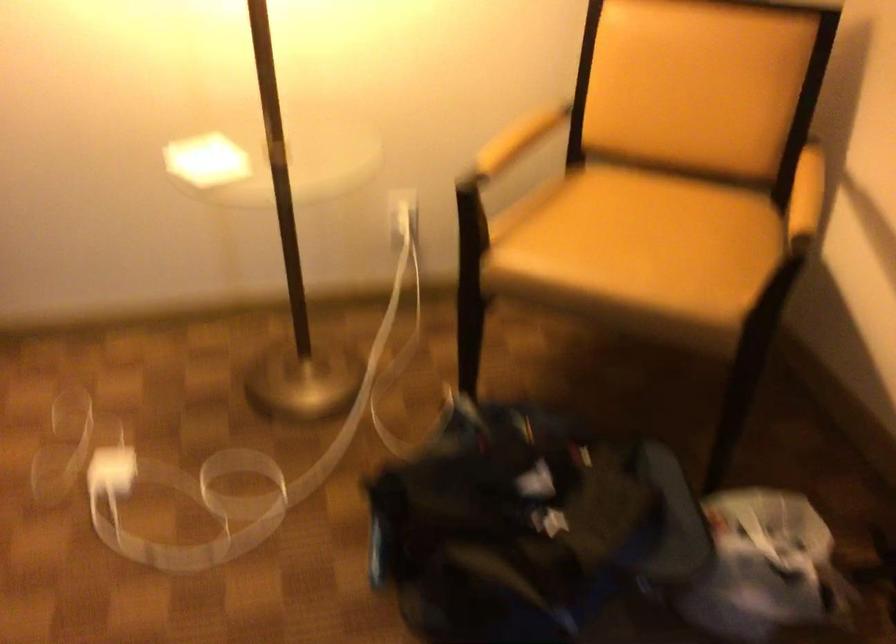
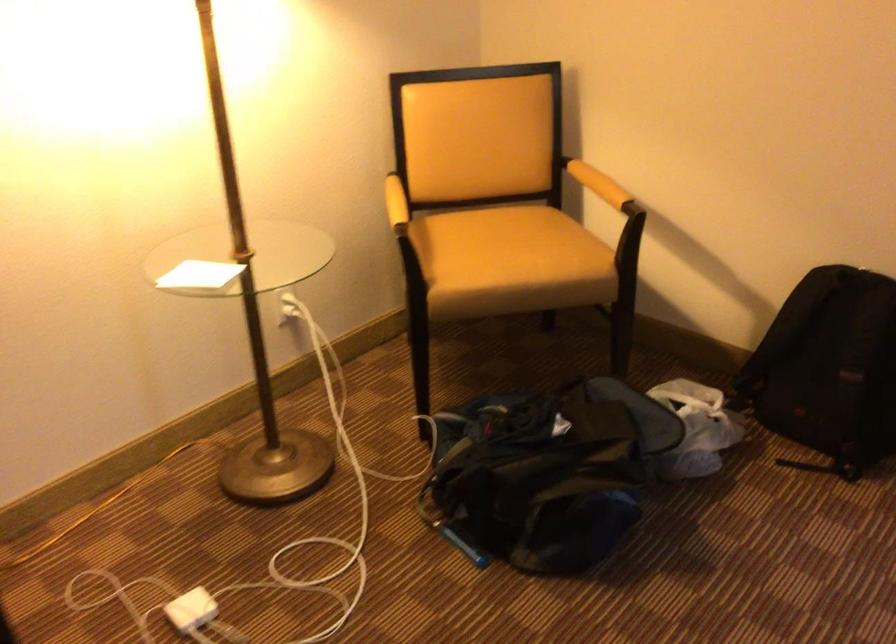
In the second image, find the point that corresponds to point (746, 576) in the first image.

(696, 428)